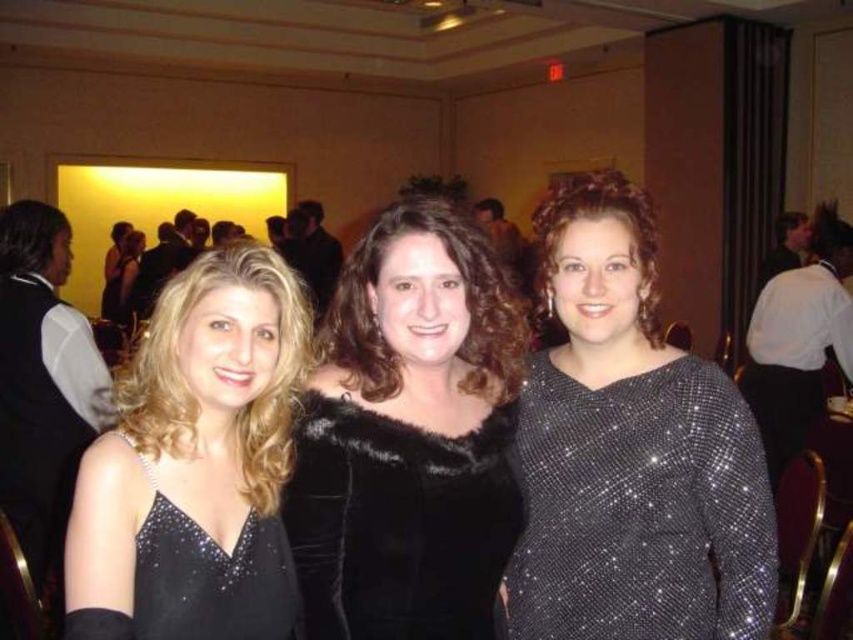
You are a photographer at the event and want to capture a closeup of the sparkly silver dress at center. You are currently positioned at point [631,451]. Is the sparkly silver dress at center in front of or behind you?

The sparkly silver dress at center is located at point [631,451], which is exactly where you are standing. Therefore, you are positioned directly at the location of the sparkly silver dress at center, so it is neither in front nor behind you.

You are standing in the banquet hall and see the velvet black fur coat at center. If you want to reach it without moving your feet, is it within arm reach?

The velvet black fur coat at center is 3.99 feet away from viewer, so it is slightly out of arm reach since the average arm span is about 3 feet. You would need to take a small step forward to grab it.

You are a photographer at this event and need to capture a photo of both the velvet black fur coat at center and the sparkly black dress at left. The camera you are using has a lens that can focus on objects within a 12 inch range. Can you fit both items into the frame without moving the camera?

The velvet black fur coat at center and the sparkly black dress at left are 10.50 inches apart from each other. Since the camera lens can focus on objects within a 12 inch range, both items can be captured in the frame without moving the camera.